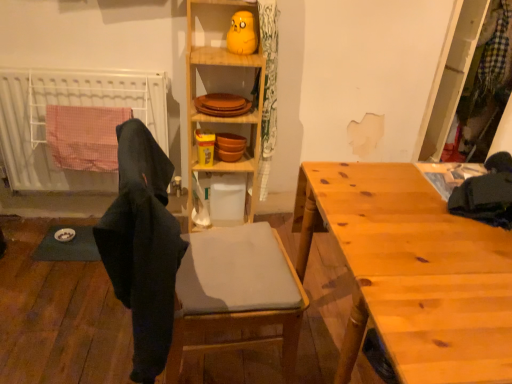
Question: Is matte gray cushioned chair at center wider than wooden plates at upper center?

Choices:
 (A) no
 (B) yes

Answer: (B)

Question: Is matte gray cushioned chair at center thinner than wooden plates at upper center?

Choices:
 (A) no
 (B) yes

Answer: (A)

Question: Is matte gray cushioned chair at center at the left side of wooden plates at upper center?

Choices:
 (A) no
 (B) yes

Answer: (B)

Question: Is matte gray cushioned chair at center outside wooden plates at upper center?

Choices:
 (A) yes
 (B) no

Answer: (A)

Question: Is matte gray cushioned chair at center oriented towards wooden plates at upper center?

Choices:
 (A) no
 (B) yes

Answer: (A)

Question: From the image's perspective, is matte gray cushioned chair at center located above wooden plates at upper center?

Choices:
 (A) no
 (B) yes

Answer: (A)

Question: From the image's perspective, does black fabric at left appear higher than wooden cabinet at center?

Choices:
 (A) no
 (B) yes

Answer: (A)

Question: From the image's perspective, is black fabric at left located beneath wooden cabinet at center?

Choices:
 (A) yes
 (B) no

Answer: (A)

Question: Considering the relative sizes of black fabric at left and wooden cabinet at center in the image provided, is black fabric at left thinner than wooden cabinet at center?

Choices:
 (A) no
 (B) yes

Answer: (B)

Question: Is black fabric at left at the right side of wooden cabinet at center?

Choices:
 (A) yes
 (B) no

Answer: (B)

Question: Is black fabric at left outside wooden cabinet at center?

Choices:
 (A) no
 (B) yes

Answer: (B)

Question: Is black fabric at left oriented towards wooden cabinet at center?

Choices:
 (A) yes
 (B) no

Answer: (B)

Question: Would you say wooden plates at upper center is a long distance from white plastic radiator at left?

Choices:
 (A) no
 (B) yes

Answer: (A)